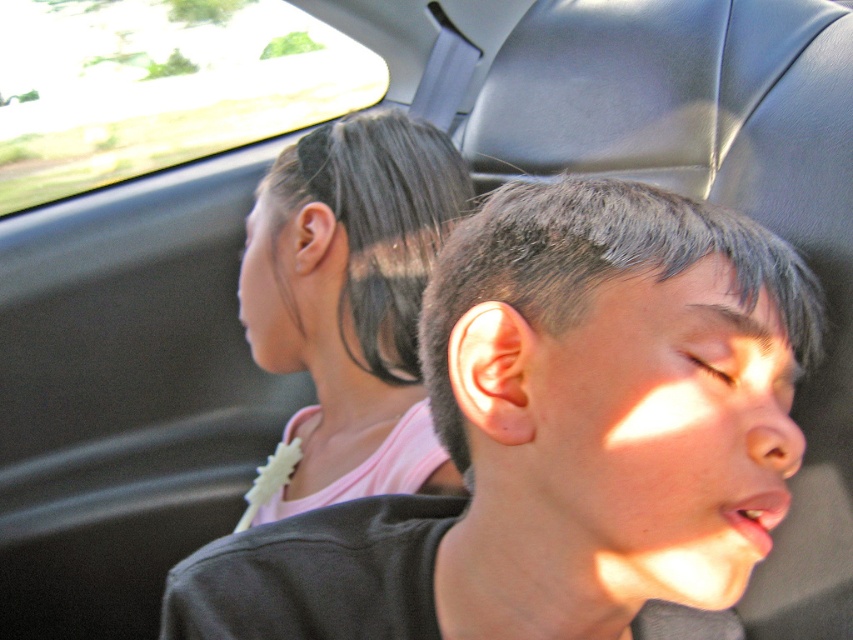
Where is `smooth pink shirt at left`? The height and width of the screenshot is (640, 853). smooth pink shirt at left is located at coordinates (350, 298).

Is smooth pink shirt at left smaller than transparent glass car window at upper left?

Yes.

Between point (368, 241) and point (292, 74), which one is positioned in front?

Point (368, 241) is in front.

This screenshot has height=640, width=853. What are the coordinates of `smooth pink shirt at left` in the screenshot? It's located at [350, 298].